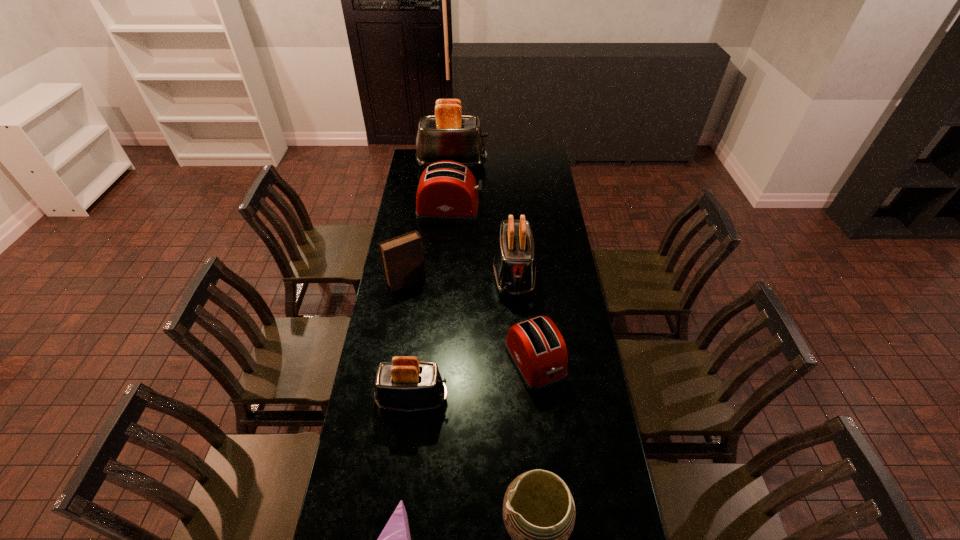
The height and width of the screenshot is (540, 960). I want to click on gray toaster that is the closest to the biggest gray toaster, so click(x=514, y=266).

Identify the location of the second closest gray toaster to the rightmost gray toaster. (x=448, y=135).

The image size is (960, 540). I want to click on vacant position in the image that satisfies the following two spatial constraints: 1. on the back side of the bigger red toaster; 2. on the left side of the Bible, so click(418, 211).

Image resolution: width=960 pixels, height=540 pixels. Find the location of `free region that satisfies the following two spatial constraints: 1. on the front side of the bigger red toaster; 2. on the left side of the nearer red toaster`. free region that satisfies the following two spatial constraints: 1. on the front side of the bigger red toaster; 2. on the left side of the nearer red toaster is located at coordinates (438, 362).

Locate an element on the screen. This screenshot has height=540, width=960. free space that satisfies the following two spatial constraints: 1. on the front side of the farther red toaster; 2. on the right side of the seventh tallest object is located at coordinates click(x=438, y=362).